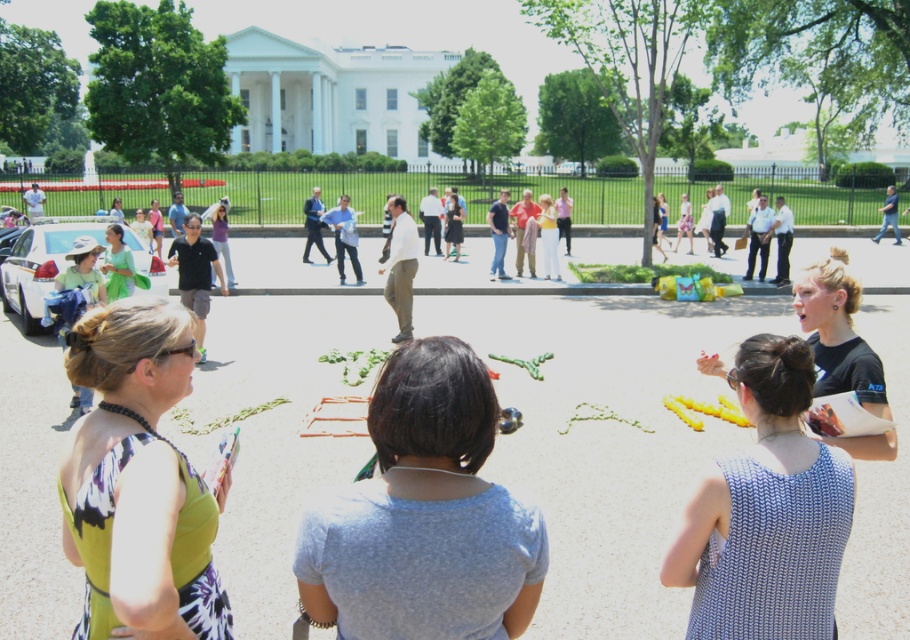
Between gray matte shirt at center and black matte shirt at lower right, which one has less height?

gray matte shirt at center is shorter.

Consider the image. Who is more distant from viewer, (369, 604) or (852, 278)?

The point (852, 278) is behind.

Locate an element on the screen. Image resolution: width=910 pixels, height=640 pixels. gray matte shirt at center is located at coordinates (423, 515).

Locate an element on the screen. white knitted tank top at center is located at coordinates (766, 513).

Which is in front, point (807, 360) or point (81, 410)?

Point (807, 360)

Find the location of a particular element. The image size is (910, 640). white knitted tank top at center is located at coordinates (766, 513).

Who is more forward, (x=198, y=596) or (x=105, y=257)?

Point (x=198, y=596) is more forward.

How far apart are green floral dress at center and matte green dress at center?

The distance of green floral dress at center from matte green dress at center is 25.09 feet.

I want to click on green floral dress at center, so click(138, 481).